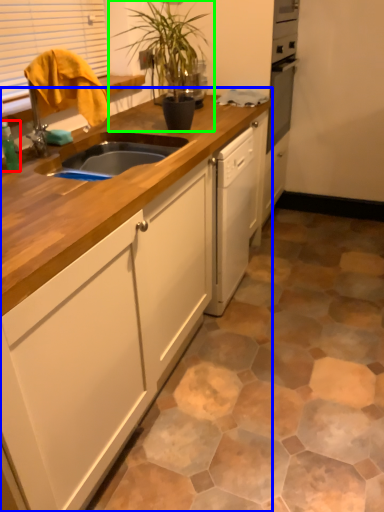
Question: Based on their relative distances, which object is farther from bottle (highlighted by a red box)? Choose from cabinetry (highlighted by a blue box) and houseplant (highlighted by a green box).

Choices:
 (A) cabinetry
 (B) houseplant

Answer: (B)